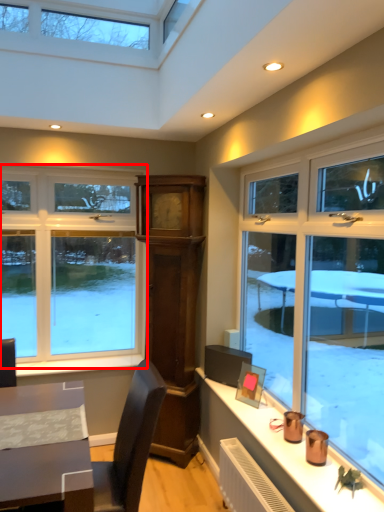
Question: In this image, where is window (annotated by the red box) located relative to window sill?

Choices:
 (A) left
 (B) right

Answer: (A)